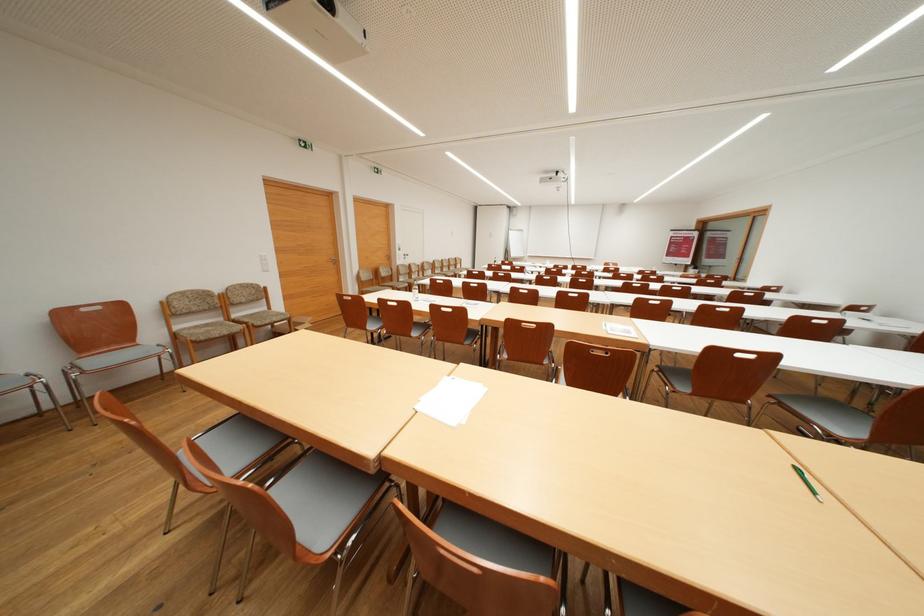
The location [807,482] corresponds to which object?

It refers to a green pen.